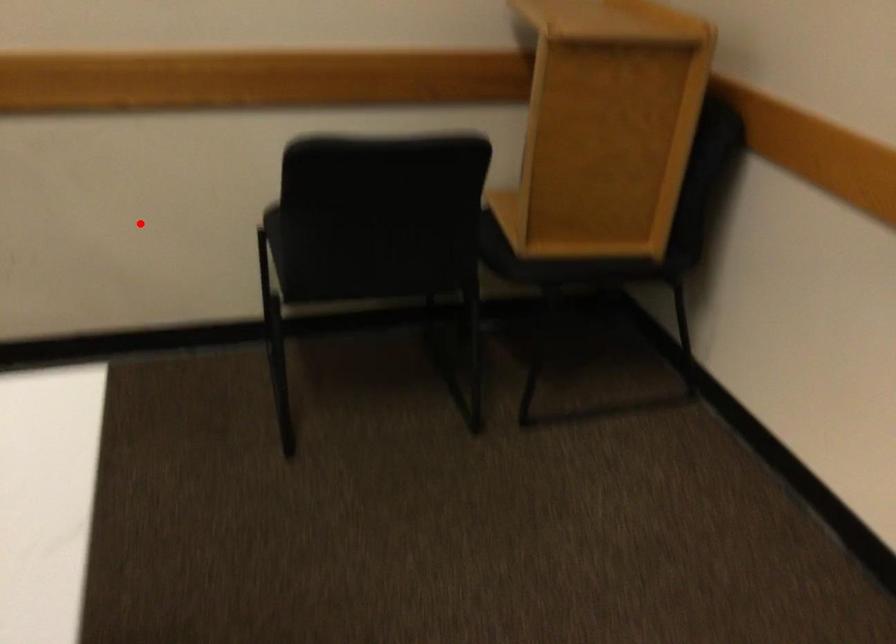
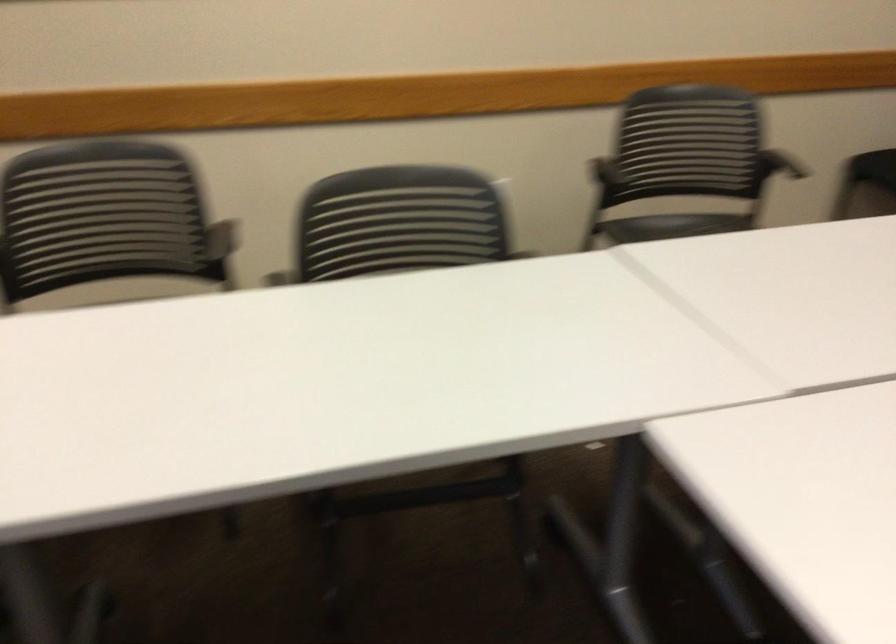
Question: I am providing you with two images of the same scene from different viewpoints. Given a red point in image1, look at the same physical point in image2. Is it:

Choices:
 (A) Closer to the viewpoint
 (B) Farther from the viewpoint

Answer: (B)